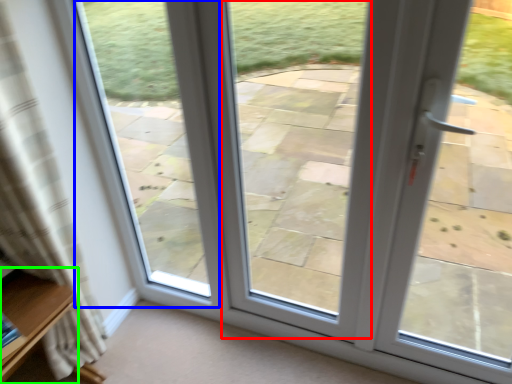
Question: Considering the real-world distances, which object is farthest from window (highlighted by a red box)? bay window (highlighted by a blue box) or furniture (highlighted by a green box)?

Choices:
 (A) bay window
 (B) furniture

Answer: (B)